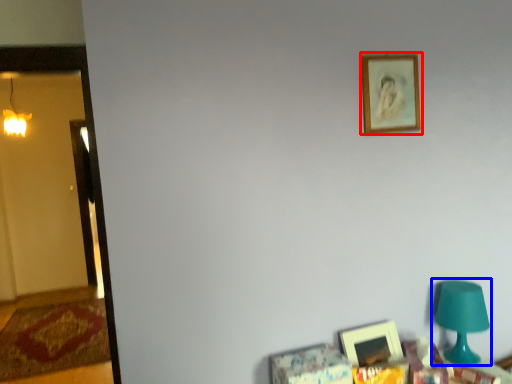
Question: Which point is closer to the camera, picture frame (highlighted by a red box) or table lamp (highlighted by a blue box)?

Choices:
 (A) picture frame
 (B) table lamp

Answer: (B)